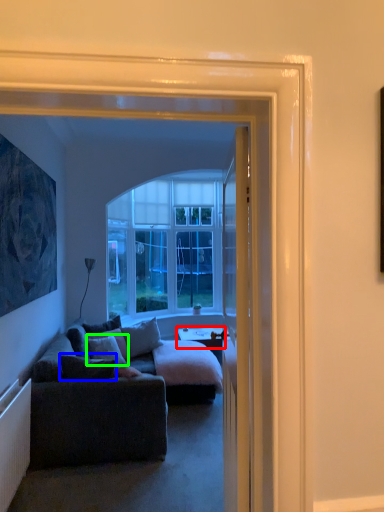
Question: Which object is positioned farthest from desk (highlighted by a red box)? Select from pillow (highlighted by a blue box) and pillow (highlighted by a green box).

Choices:
 (A) pillow
 (B) pillow

Answer: (A)